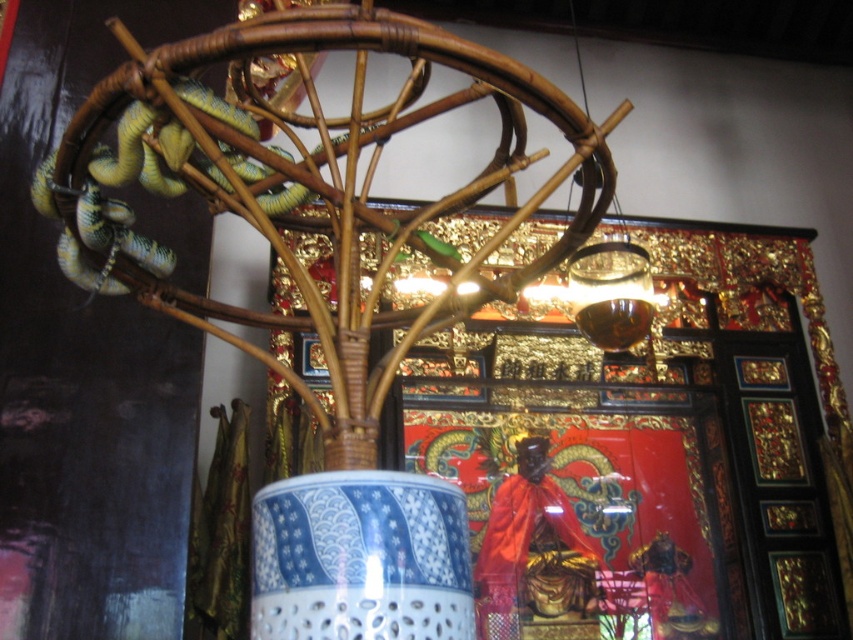
You are standing in the room and want to reach a point that is 3.57 meters away from you. Is the point at coordinates point (257, 496) within this distance?

The point at point (257, 496) is exactly 3.57 meters away from the viewer, so yes, it is within the desired distance.

You are an interior designer planning to place a new rectangular shelf that is 1 meter wide in this space. The shelf must be placed either next to the blue porcelain vase at center or the green glossy snake at upper left. Based on their widths, which object should you choose to ensure the shelf fits without overlapping?

The blue porcelain vase at center has a width less than the green glossy snake at upper left, so placing the 1 meter wide shelf next to the green glossy snake at upper left would provide enough space since it is wider.